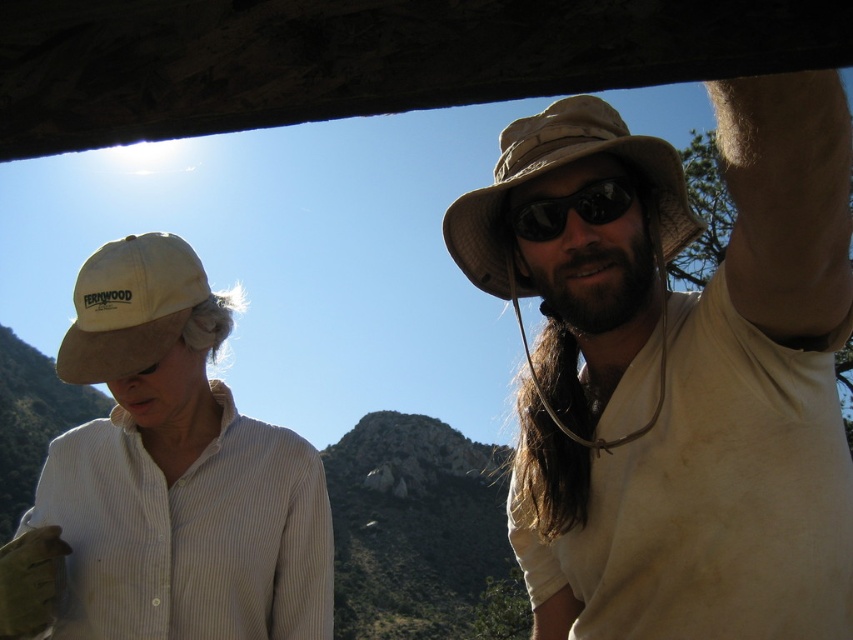
Does matte khaki hat at upper right have a larger size compared to black matte sunglasses at upper center?

Correct, matte khaki hat at upper right is larger in size than black matte sunglasses at upper center.

Image resolution: width=853 pixels, height=640 pixels. What do you see at coordinates (682, 372) in the screenshot? I see `matte khaki hat at upper right` at bounding box center [682, 372].

Does point (662, 497) come behind point (611, 180)?

No, it is in front of (611, 180).

Where is `matte khaki hat at upper right`? The image size is (853, 640). matte khaki hat at upper right is located at coordinates (682, 372).

Who is higher up, white cotton shirt at left or black matte sunglasses at upper center?

black matte sunglasses at upper center is above.

Is white cotton shirt at left further to camera compared to black matte sunglasses at upper center?

No.

Describe the element at coordinates (166, 480) in the screenshot. I see `white cotton shirt at left` at that location.

Identify the location of white cotton shirt at left. (166, 480).

Between point (827, 467) and point (560, 150), which one is positioned behind?

Positioned behind is point (560, 150).

Which is above, matte khaki hat at upper right or tan fabric cowboy hat at upper right?

tan fabric cowboy hat at upper right is above.

Who is more distant from viewer, (569, 452) or (508, 160)?

The point (569, 452) is more distant.

Locate an element on the screen. The image size is (853, 640). matte khaki hat at upper right is located at coordinates (682, 372).